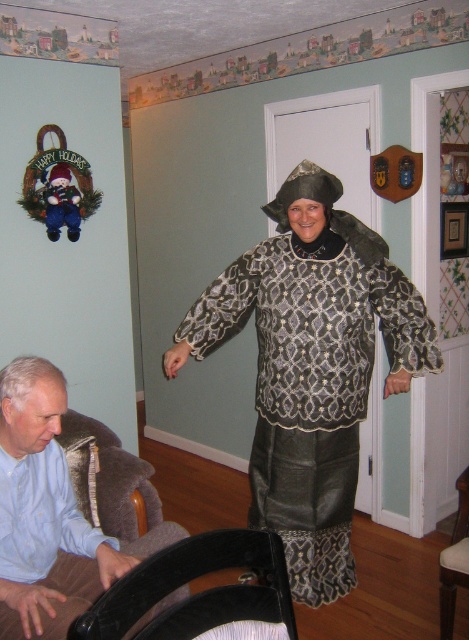
Measure the distance between matte black dress at center and light blue shirt at lower left.

The distance of matte black dress at center from light blue shirt at lower left is 89.35 centimeters.

Does matte black dress at center have a greater height compared to light blue shirt at lower left?

Yes.

Identify the location of matte black dress at center. (311, 365).

Is matte black dress at center closer to the viewer compared to brown fabric armchair at lower left?

No.

Which is in front, point (176, 332) or point (452, 593)?

Point (452, 593) is in front.

Between point (310, 440) and point (464, 508), which one is positioned behind?

Positioned behind is point (310, 440).

Locate an element on the screen. The width and height of the screenshot is (469, 640). matte black dress at center is located at coordinates (311, 365).

Does black leather armchair at lower left have a greater height compared to brown fabric armchair at lower left?

In fact, black leather armchair at lower left may be shorter than brown fabric armchair at lower left.

Does black leather armchair at lower left appear on the left side of brown fabric armchair at lower left?

Indeed, black leather armchair at lower left is positioned on the left side of brown fabric armchair at lower left.

Does point (195, 554) come behind point (464, 547)?

No, it is in front of (464, 547).

Where is `black leather armchair at lower left`? The width and height of the screenshot is (469, 640). black leather armchair at lower left is located at coordinates (196, 593).